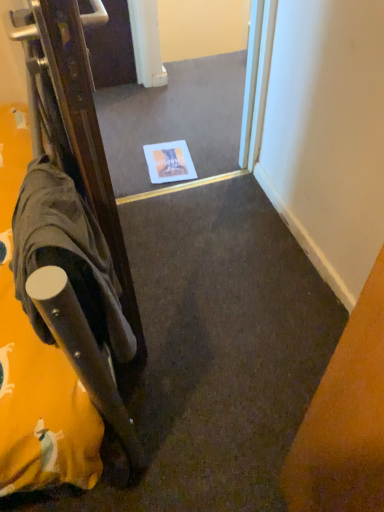
Question: Considering the positions of point (92, 298) and point (132, 175), is point (92, 298) closer or farther from the camera than point (132, 175)?

Choices:
 (A) farther
 (B) closer

Answer: (B)

Question: Is dark gray fabric robe at left taller or shorter than white glossy mirror at center?

Choices:
 (A) tall
 (B) short

Answer: (A)

Question: Is dark gray fabric robe at left wider or thinner than white glossy mirror at center?

Choices:
 (A) wide
 (B) thin

Answer: (B)

Question: From a real-world perspective, is white glossy mirror at center above or below dark gray fabric robe at left?

Choices:
 (A) above
 (B) below

Answer: (B)

Question: Is point (130, 102) positioned closer to the camera than point (84, 261)?

Choices:
 (A) closer
 (B) farther

Answer: (B)

Question: In terms of width, does white glossy mirror at center look wider or thinner when compared to dark gray fabric robe at left?

Choices:
 (A) thin
 (B) wide

Answer: (B)

Question: In terms of size, does white glossy mirror at center appear bigger or smaller than dark gray fabric robe at left?

Choices:
 (A) big
 (B) small

Answer: (A)